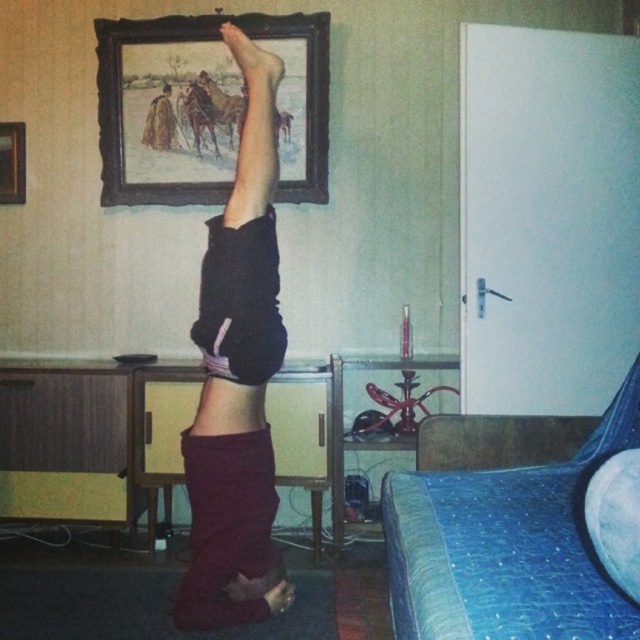
Question: Which object appears farthest from the camera in this image?

Choices:
 (A) brown wooden frame at upper center
 (B) blue textured bed at lower right
 (C) maroon fabric pants at center

Answer: (A)

Question: Observing the image, what is the correct spatial positioning of maroon fabric pants at center in reference to brown wooden frame at upper center?

Choices:
 (A) above
 (B) below

Answer: (B)

Question: Which is farther from the wooden picture frame at upper left?

Choices:
 (A) blue textured bed at lower right
 (B) maroon fabric pants at center

Answer: (A)

Question: Considering the real-world distances, which object is closest to the maroon fabric pants at center?

Choices:
 (A) brown wooden frame at upper center
 (B) wooden picture frame at upper left
 (C) blue textured bed at lower right

Answer: (C)

Question: Does brown wooden frame at upper center appear on the left side of wooden picture frame at upper left?

Choices:
 (A) no
 (B) yes

Answer: (A)

Question: Is brown wooden frame at upper center below wooden picture frame at upper left?

Choices:
 (A) yes
 (B) no

Answer: (B)